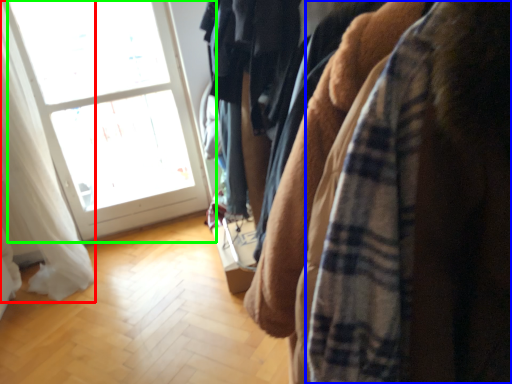
Question: Based on their relative distances, which object is nearer to curtain (highlighted by a red box)? Choose from flannel (highlighted by a blue box) and window (highlighted by a green box).

Choices:
 (A) flannel
 (B) window

Answer: (B)